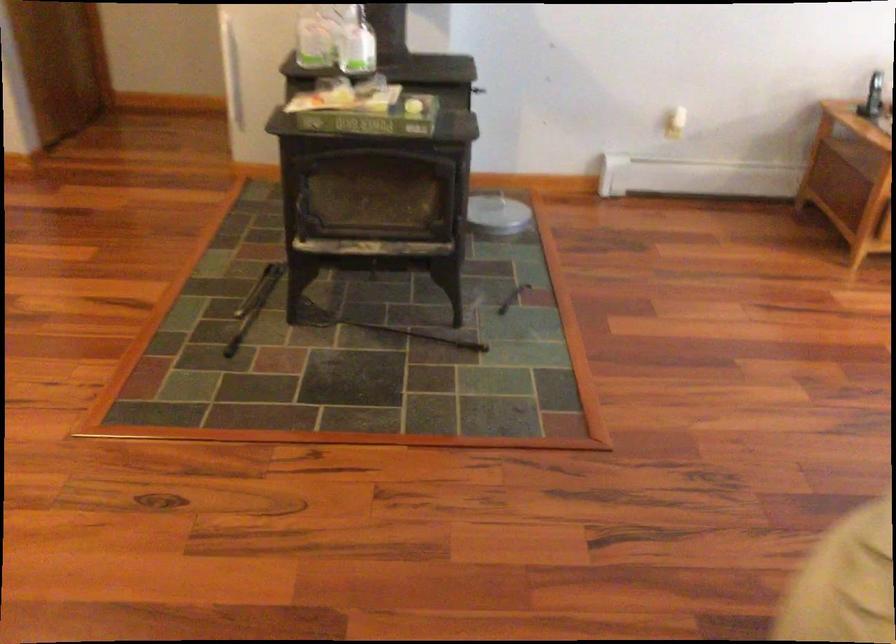
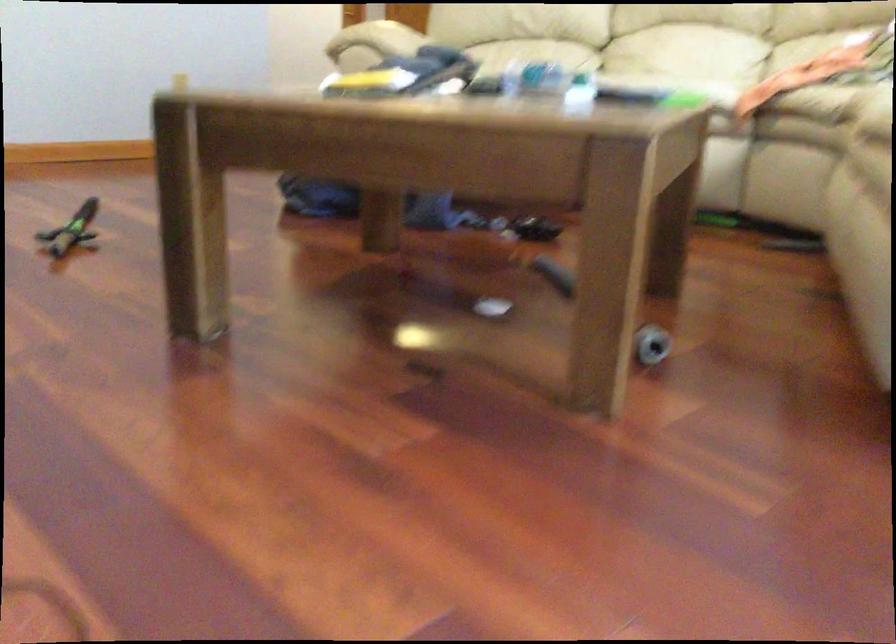
Question: I am providing you with two images of the same scene from different viewpoints. Which of the following objects are not visible in image2?

Choices:
 (A) clear plastic bottle
 (B) black top tray
 (C) metal lid handle
 (D) sofa sitting surface

Answer: (C)